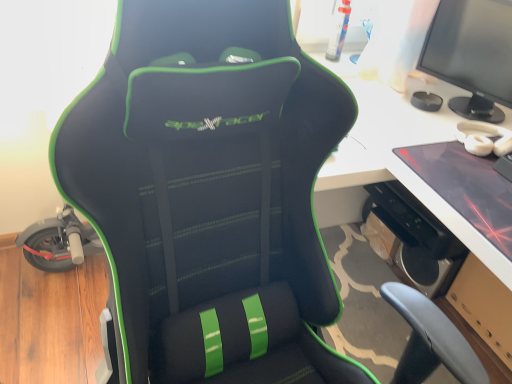
The width and height of the screenshot is (512, 384). Describe the element at coordinates (374, 139) in the screenshot. I see `white glossy computer desk at center` at that location.

The width and height of the screenshot is (512, 384). What do you see at coordinates (472, 55) in the screenshot? I see `matte black monitor at upper right` at bounding box center [472, 55].

Locate an element on the screen. The width and height of the screenshot is (512, 384). white glossy computer desk at center is located at coordinates (374, 139).

Which of these two, white glossy computer desk at center or black matte speaker at lower right, stands shorter?

black matte speaker at lower right.

Based on their positions, is white glossy computer desk at center located to the left or right of black matte speaker at lower right?

Based on their positions, white glossy computer desk at center is located to the left of black matte speaker at lower right.

Considering the positions of points (359, 154) and (406, 262), is point (359, 154) farther from camera compared to point (406, 262)?

No.

Between matte black monitor at upper right and matte black laptop at right, which one has larger size?

Bigger between the two is matte black monitor at upper right.

From their relative heights in the image, would you say matte black monitor at upper right is taller or shorter than matte black laptop at right?

Considering their sizes, matte black monitor at upper right has more height than matte black laptop at right.

Which is in front, matte black monitor at upper right or matte black laptop at right?

matte black laptop at right is closer to the camera.

Is matte black monitor at upper right facing away from matte black laptop at right?

matte black monitor at upper right does not have its back to matte black laptop at right.

Is black matte speaker at lower right at the left side of matte black laptop at right?

No, black matte speaker at lower right is not to the left of matte black laptop at right.

How distant is black matte speaker at lower right from matte black laptop at right?

black matte speaker at lower right and matte black laptop at right are 59.59 centimeters apart.

Which object is closer to the camera, black matte speaker at lower right or matte black laptop at right?

matte black laptop at right is in front.

Is black matte speaker at lower right far from matte black laptop at right?

That's not correct — black matte speaker at lower right is a little close to matte black laptop at right.

Which object is further away from the camera taking this photo, matte black laptop at right or black matte speaker at lower right?

black matte speaker at lower right.

Can you tell me how much matte black laptop at right and black matte speaker at lower right differ in facing direction?

They differ by 4.22 degrees in their facing directions.

In the image, there is a black matte speaker at lower right. Where is `laptop above it (from the image's perspective)`? The image size is (512, 384). laptop above it (from the image's perspective) is located at coordinates (466, 187).

Based on the photo, between matte black laptop at right and black matte speaker at lower right, which one appears on the right side from the viewer's perspective?

From the viewer's perspective, black matte speaker at lower right appears more on the right side.

How far apart are matte black laptop at right and white glossy computer desk at center?

matte black laptop at right is 5.72 inches from white glossy computer desk at center.

Where is `laptop on the right of white glossy computer desk at center`? This screenshot has height=384, width=512. laptop on the right of white glossy computer desk at center is located at coordinates (466, 187).

Does matte black laptop at right have a greater width compared to white glossy computer desk at center?

Incorrect, the width of matte black laptop at right does not surpass that of white glossy computer desk at center.

Which is nearer, (505, 240) or (478, 354)?

Point (505, 240)

From the image's perspective, between white glossy computer desk at center and matte black monitor at upper right, which one is located above?

matte black monitor at upper right, from the image's perspective.

Is white glossy computer desk at center not inside matte black monitor at upper right?

That's correct, white glossy computer desk at center is outside of matte black monitor at upper right.

Between white glossy computer desk at center and matte black monitor at upper right, which one has less height?

matte black monitor at upper right is shorter.

The width and height of the screenshot is (512, 384). I want to click on computer monitor on the right of matte black laptop at right, so click(x=472, y=55).

Considering the relative positions of matte black laptop at right and matte black monitor at upper right in the image provided, is matte black laptop at right to the left or to the right of matte black monitor at upper right?

In the image, matte black laptop at right appears on the left side of matte black monitor at upper right.

In the scene shown: Is matte black laptop at right closer to camera compared to matte black monitor at upper right?

Yes.

At what (x,y) coordinates should I click in order to perform the action: click on computer desk above the black matte speaker at lower right (from a real-world perspective). Please return your answer as a coordinate pair (x, y). The image size is (512, 384). Looking at the image, I should click on (374, 139).

Find the location of a particular element. The height and width of the screenshot is (384, 512). laptop located underneath the matte black monitor at upper right (from a real-world perspective) is located at coordinates (466, 187).

When comparing their distances from black matte speaker at lower right, does white glossy computer desk at center or matte black monitor at upper right seem further?

matte black monitor at upper right is further to black matte speaker at lower right.

When comparing their distances from black matte speaker at lower right, does matte black laptop at right or matte black monitor at upper right seem closer?

matte black laptop at right is positioned closer to the anchor black matte speaker at lower right.

Which object lies further to the anchor point matte black laptop at right, matte black monitor at upper right or white glossy computer desk at center?

Based on the image, matte black monitor at upper right appears to be further to matte black laptop at right.

Which object lies further to the anchor point white glossy computer desk at center, matte black laptop at right or matte black monitor at upper right?

matte black monitor at upper right is further to white glossy computer desk at center.

When comparing their distances from white glossy computer desk at center, does black matte speaker at lower right or matte black laptop at right seem closer?

matte black laptop at right lies closer to white glossy computer desk at center than the other object.

Which object lies further to the anchor point matte black monitor at upper right, white glossy computer desk at center or matte black laptop at right?

Based on the image, matte black laptop at right appears to be further to matte black monitor at upper right.

Based on their spatial positions, is white glossy computer desk at center or black matte speaker at lower right further from matte black laptop at right?

black matte speaker at lower right.

Based on their spatial positions, is matte black laptop at right or white glossy computer desk at center further from black matte speaker at lower right?

matte black laptop at right is further to black matte speaker at lower right.

The width and height of the screenshot is (512, 384). I want to click on computer monitor between white glossy computer desk at center and black matte speaker at lower right in the front-back direction, so click(472, 55).

Find the location of a particular element. Image resolution: width=512 pixels, height=384 pixels. laptop between matte black monitor at upper right and white glossy computer desk at center in the vertical direction is located at coordinates (466, 187).

Locate an element on the screen. laptop positioned between white glossy computer desk at center and black matte speaker at lower right from near to far is located at coordinates (466, 187).

The height and width of the screenshot is (384, 512). What are the coordinates of `laptop between matte black monitor at upper right and black matte speaker at lower right vertically` in the screenshot? It's located at (466, 187).